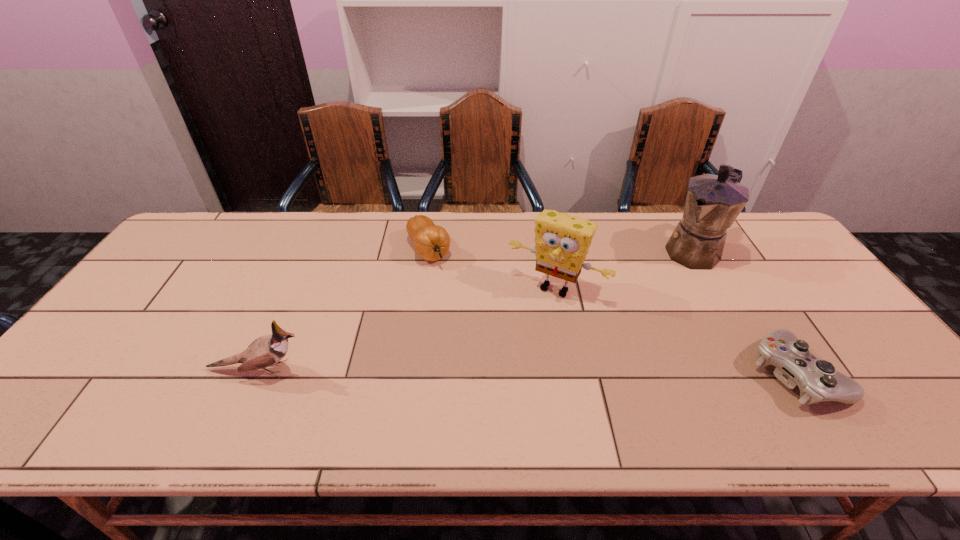
The image size is (960, 540). Find the location of `coffeepot located in the far edge section of the desktop`. coffeepot located in the far edge section of the desktop is located at coordinates (713, 202).

Image resolution: width=960 pixels, height=540 pixels. In order to click on bird that is positioned at the near edge in this screenshot , I will do `click(265, 351)`.

Find the location of a particular element. control that is at the near edge is located at coordinates (818, 381).

Locate an element on the screen. This screenshot has height=540, width=960. object located at the right edge is located at coordinates (818, 381).

The height and width of the screenshot is (540, 960). In order to click on object present at the near right corner in this screenshot , I will do `click(818, 381)`.

Find the location of a particular element. The height and width of the screenshot is (540, 960). free space at the far edge is located at coordinates (488, 247).

Find the location of a particular element. free space at the near edge is located at coordinates (321, 392).

Where is `vacant position at the left edge of the desktop`? This screenshot has width=960, height=540. vacant position at the left edge of the desktop is located at coordinates (132, 343).

Where is `vacant area at the right edge`? vacant area at the right edge is located at coordinates (850, 351).

Image resolution: width=960 pixels, height=540 pixels. In the image, there is a desktop. In order to click on vacant space at the far left corner in this screenshot , I will do click(x=218, y=228).